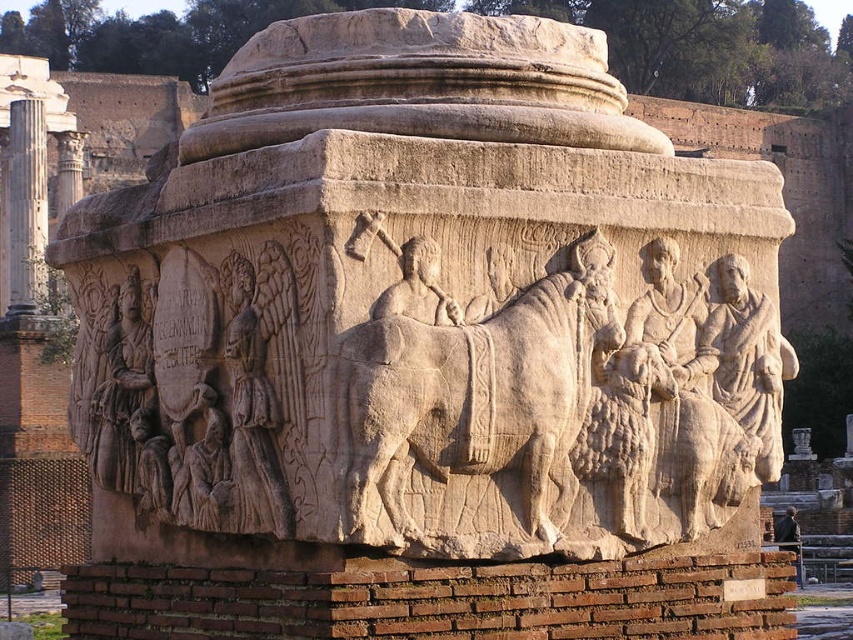
Can you confirm if beige stone horse at center is positioned to the right of light beige stone figures at lower left?

Yes, beige stone horse at center is to the right of light beige stone figures at lower left.

Based on the photo, does beige stone horse at center come behind light beige stone figures at lower left?

No.

Find the location of `beige stone horse at center`. beige stone horse at center is located at coordinates [x=477, y=394].

Which of these two, light beige stone figure at center or light beige stone figures at lower left, stands shorter?

light beige stone figure at center

Does light beige stone figure at center have a smaller size compared to light beige stone figures at lower left?

Actually, light beige stone figure at center might be larger than light beige stone figures at lower left.

Is point (724, 275) behind point (105, 449)?

No, (724, 275) is closer to viewer.

This screenshot has height=640, width=853. I want to click on light beige stone figure at center, so click(x=747, y=360).

Is beige stone horse at center bigger than light beige stone figure at center?

Yes, beige stone horse at center is bigger than light beige stone figure at center.

Who is positioned more to the right, beige stone horse at center or light beige stone figure at center?

From the viewer's perspective, light beige stone figure at center appears more on the right side.

Does point (467, 452) come behind point (766, 308)?

No, (467, 452) is in front of (766, 308).

Where is `beige stone horse at center`? beige stone horse at center is located at coordinates (477, 394).